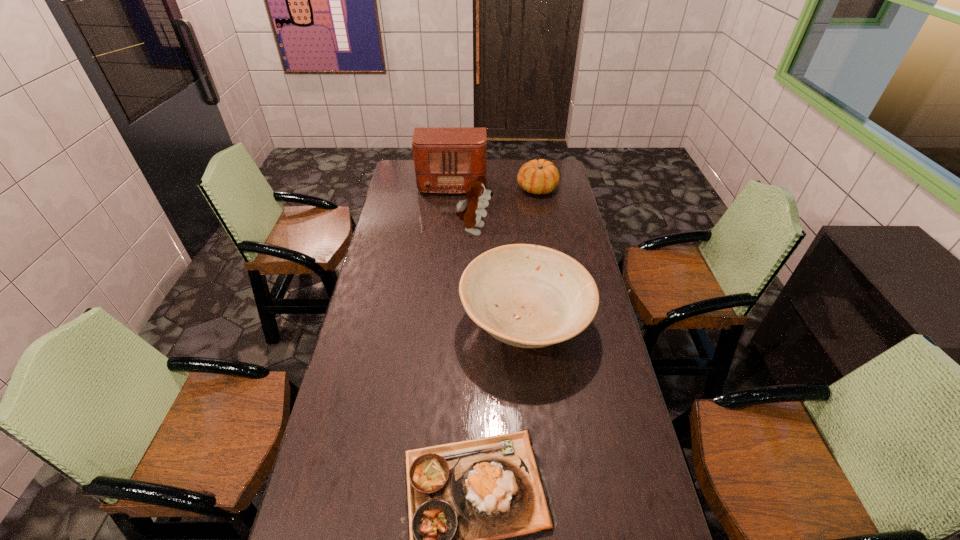
The height and width of the screenshot is (540, 960). In the image, there is a desktop. In order to click on free space at the far right corner in this screenshot , I will do `click(564, 179)`.

Identify the location of free space that is in between the gourd and the puppy. (505, 210).

What are the coordinates of `empty space between the puppy and the gourd` in the screenshot? It's located at pyautogui.click(x=505, y=210).

Identify which object is the nearest to the puppy. Please provide its 2D coordinates. Your answer should be formatted as a tuple, i.e. [(x, y)], where the tuple contains the x and y coordinates of a point satisfying the conditions above.

[(445, 159)]

Locate an element on the screen. This screenshot has height=540, width=960. object that is the nearest to the radio receiver is located at coordinates (540, 176).

This screenshot has height=540, width=960. Find the location of `vacant space that satisfies the following two spatial constraints: 1. on the face of the third shortest object; 2. on the left side of the puppy`. vacant space that satisfies the following two spatial constraints: 1. on the face of the third shortest object; 2. on the left side of the puppy is located at coordinates (472, 325).

Identify the location of free spot that satisfies the following two spatial constraints: 1. on the back side of the third shortest object; 2. on the right side of the gourd. This screenshot has width=960, height=540. (512, 188).

Locate an element on the screen. vacant space that satisfies the following two spatial constraints: 1. on the face of the third farthest object; 2. on the back side of the dish is located at coordinates (472, 325).

Image resolution: width=960 pixels, height=540 pixels. Find the location of `vacant space that satisfies the following two spatial constraints: 1. on the face of the puppy; 2. on the right side of the third shortest object`. vacant space that satisfies the following two spatial constraints: 1. on the face of the puppy; 2. on the right side of the third shortest object is located at coordinates (472, 325).

At what (x,y) coordinates should I click in order to perform the action: click on vacant region that satisfies the following two spatial constraints: 1. on the front panel of the dish; 2. on the right side of the radio receiver. Please return your answer as a coordinate pair (x, y). The height and width of the screenshot is (540, 960). Looking at the image, I should click on (440, 325).